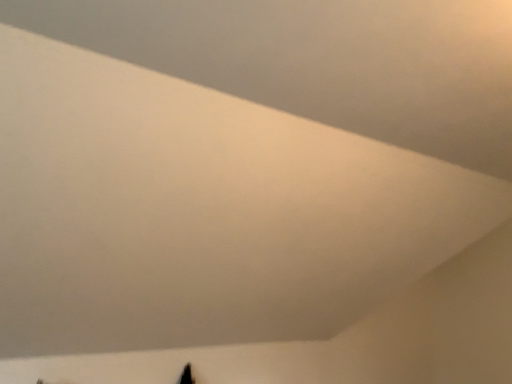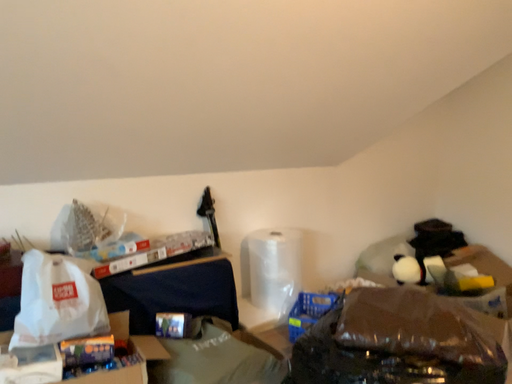
Question: Which way did the camera rotate in the video?

Choices:
 (A) rotated upward
 (B) rotated downward

Answer: (B)